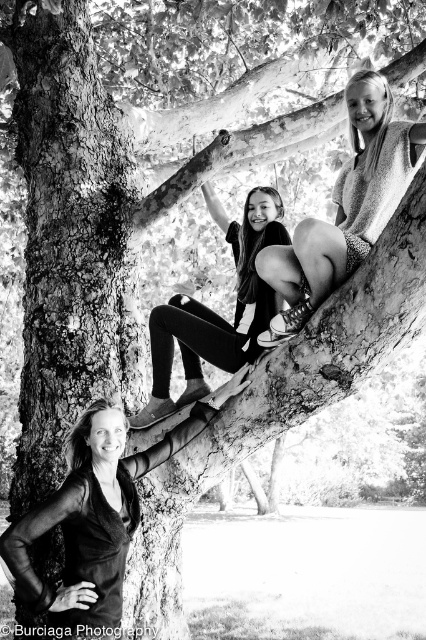
Question: Can you confirm if matte black leggings at center is positioned above rough bark tree branch at upper center?

Choices:
 (A) no
 (B) yes

Answer: (A)

Question: Which of the following is the farthest from the observer?

Choices:
 (A) matte black leggings at upper center
 (B) rough bark tree branch at upper center
 (C) smooth black dress at lower left
 (D) matte black leggings at center

Answer: (B)

Question: Estimate the real-world distances between objects in this image. Which object is farther from the matte black leggings at center?

Choices:
 (A) rough bark tree branch at upper center
 (B) matte black leggings at upper center

Answer: (A)

Question: Is matte black leggings at upper center below matte black leggings at center?

Choices:
 (A) no
 (B) yes

Answer: (A)

Question: Considering the real-world distances, which object is closest to the rough bark tree branch at upper center?

Choices:
 (A) matte black leggings at upper center
 (B) smooth black dress at lower left

Answer: (A)

Question: Does smooth black dress at lower left have a larger size compared to matte black leggings at center?

Choices:
 (A) yes
 (B) no

Answer: (B)